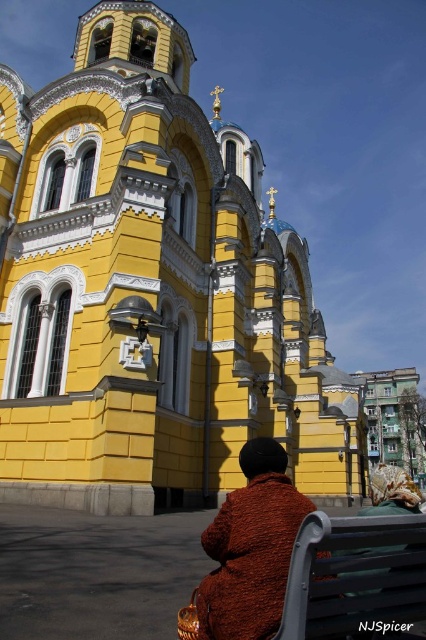
You are standing in front of the yellow stone church at center and want to place a small bench next to the brown fuzzy coat at lower right. Can you determine if the church is wide enough to accommodate the bench without blocking the coat?

The yellow stone church at center might be wider than brown fuzzy coat at lower right, so there might be enough space to place the bench next to the coat without blocking it, but the exact width is uncertain.

You are a photographer trying to capture a photo of the yellow stone church at center and the knitted brown coat at center in the same frame. Based on their sizes, which object should you focus on first to ensure both are clearly visible in the photo?

The yellow stone church at center is bigger than the knitted brown coat at center, so you should focus on the yellow stone church at center first to ensure both are clearly visible in the photo.